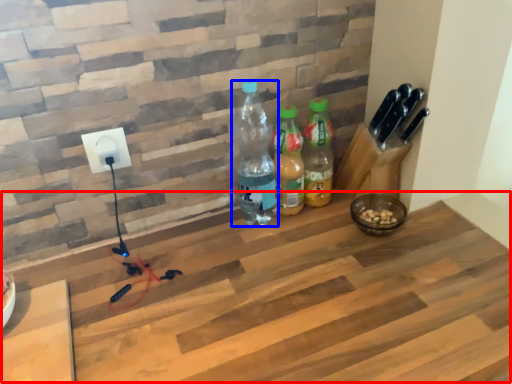
Question: Which object appears farthest to the camera in this image, workbench (highlighted by a red box) or bottle (highlighted by a blue box)?

Choices:
 (A) workbench
 (B) bottle

Answer: (B)